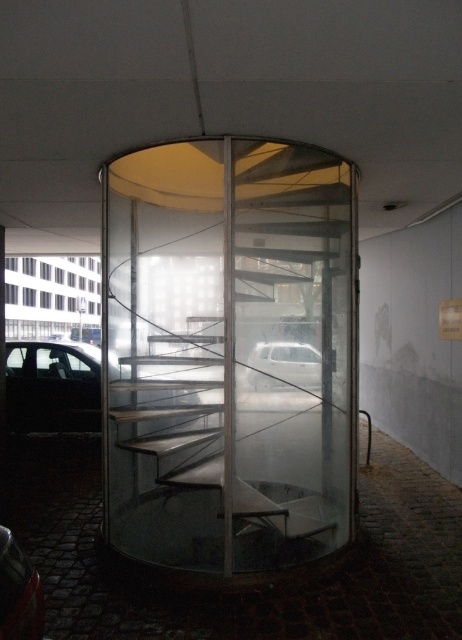
Between white glass parking garage at left and white matte car at center, which one is positioned higher?

white glass parking garage at left is above.

Does white glass parking garage at left appear under white matte car at center?

No.

Between point (97, 269) and point (315, 360), which one is positioned behind?

The point (97, 269) is more distant.

Image resolution: width=462 pixels, height=640 pixels. I want to click on white glass parking garage at left, so click(50, 296).

Does white glass parking garage at left have a larger size compared to shiny red car at lower left?

Yes.

This screenshot has height=640, width=462. What do you see at coordinates (50, 296) in the screenshot?
I see `white glass parking garage at left` at bounding box center [50, 296].

Where is `white glass parking garage at left`? white glass parking garage at left is located at coordinates (50, 296).

Between transparent glass spiral staircase at center and white matte car at center, which one is positioned lower?

transparent glass spiral staircase at center is below.

Which is above, transparent glass spiral staircase at center or white matte car at center?

white matte car at center

The width and height of the screenshot is (462, 640). Describe the element at coordinates (228, 353) in the screenshot. I see `transparent glass spiral staircase at center` at that location.

This screenshot has width=462, height=640. I want to click on transparent glass spiral staircase at center, so click(228, 353).